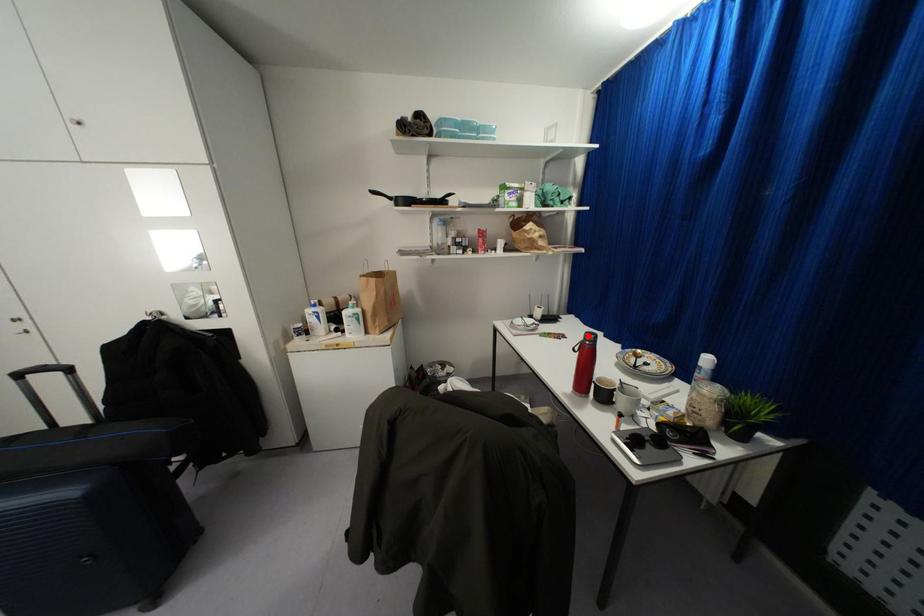
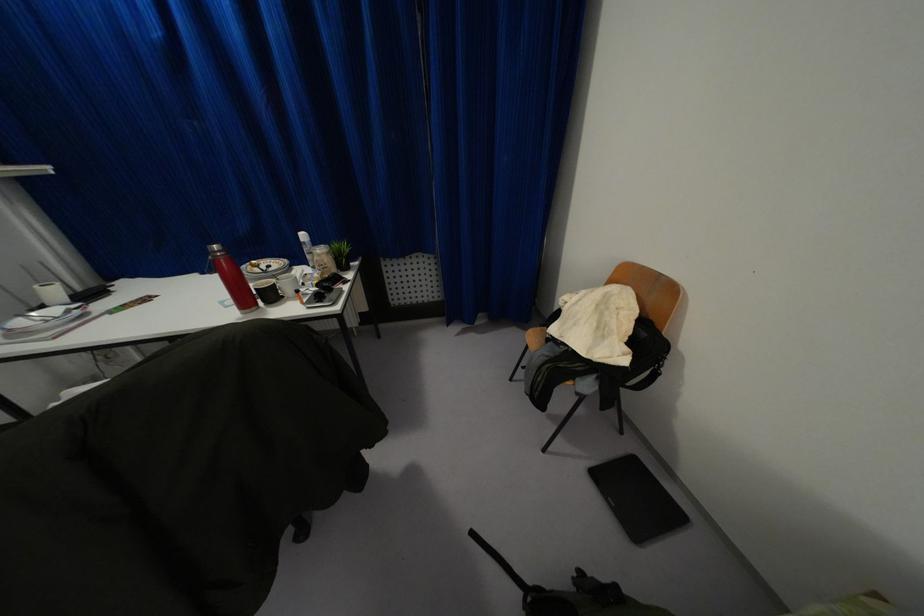
Question: I am providing you with two images of the same scene from different viewpoints. A red point is shown in image1. For the corresponding object point in image2, is it positioned nearer or farther from the camera?

Choices:
 (A) Nearer
 (B) Farther

Answer: (B)